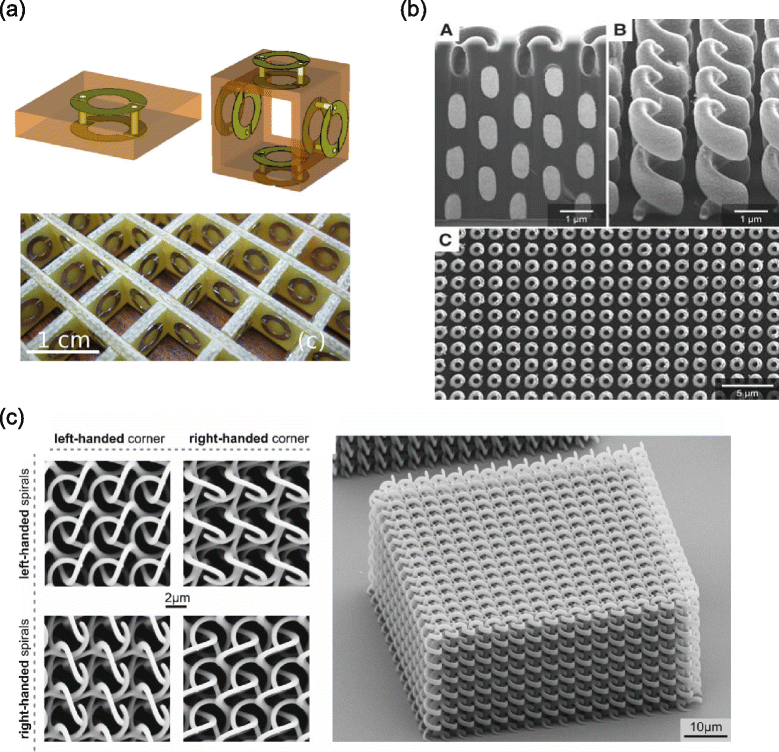
This screenshot has width=779, height=752. In order to click on corner in this screenshot , I will do `click(435, 644)`, `click(382, 489)`, `click(633, 452)`, `click(700, 607)`.